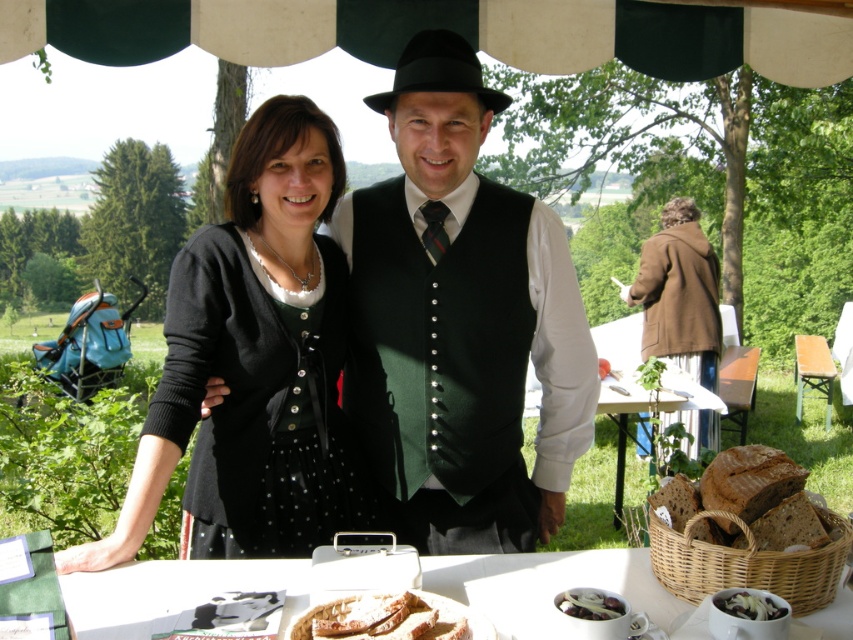
Question: Which of the following is the farthest from the observer?

Choices:
 (A) white creamy cheese at lower right
 (B) black dotted fabric dress at left
 (C) slightly toasted bread at lower center

Answer: (B)

Question: Which object is farther from the camera taking this photo?

Choices:
 (A) brown woolen coat at right
 (B) black dotted fabric dress at left
 (C) white ceramic plate at lower center

Answer: (A)

Question: Among these objects, which one is farthest from the camera?

Choices:
 (A) black dotted fabric dress at left
 (B) brown rustic bread at lower right

Answer: (A)

Question: Does golden brown bread at center appear on the right side of slightly toasted bread at lower center?

Choices:
 (A) yes
 (B) no

Answer: (B)

Question: Is black dotted fabric dress at left closer to camera compared to brown rustic bread at lower right?

Choices:
 (A) no
 (B) yes

Answer: (A)

Question: Is white ceramic plate at lower center to the left of slightly toasted bread at lower center from the viewer's perspective?

Choices:
 (A) no
 (B) yes

Answer: (B)